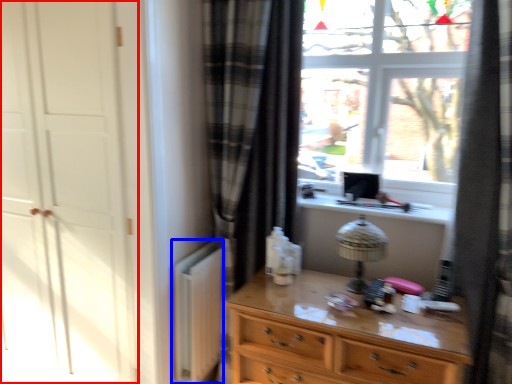
Question: Which object is further to the camera taking this photo, screen door (highlighted by a red box) or radiator (highlighted by a blue box)?

Choices:
 (A) screen door
 (B) radiator

Answer: (B)